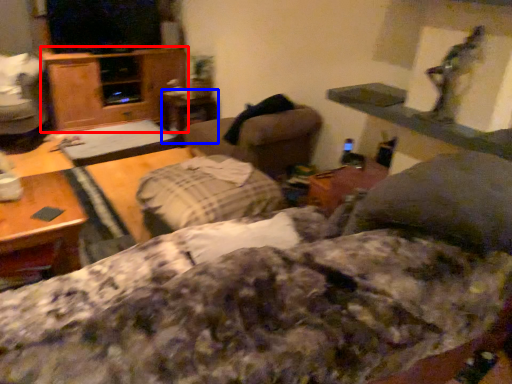
Question: Which object appears closest to the camera in this image, dresser (highlighted by a red box) or table (highlighted by a blue box)?

Choices:
 (A) dresser
 (B) table

Answer: (A)